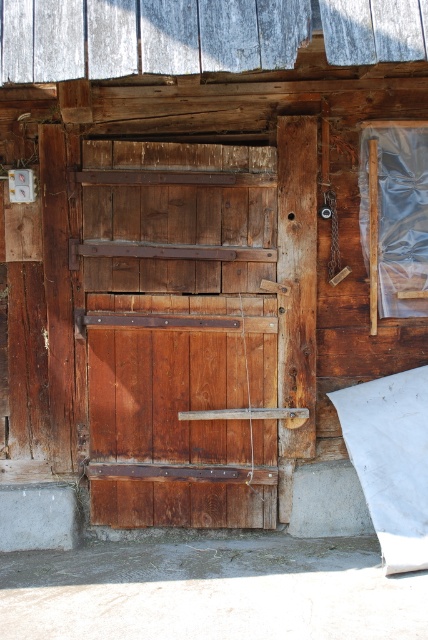
Between rustic wood barn door at center and rustic wood door at center, which one has less height?

rustic wood door at center

Is rustic wood barn door at center to the right of rustic wood door at center from the viewer's perspective?

In fact, rustic wood barn door at center is to the left of rustic wood door at center.

Find the location of a particular element. rustic wood barn door at center is located at coordinates (178, 330).

Find the location of a particular element. rustic wood barn door at center is located at coordinates (178, 330).